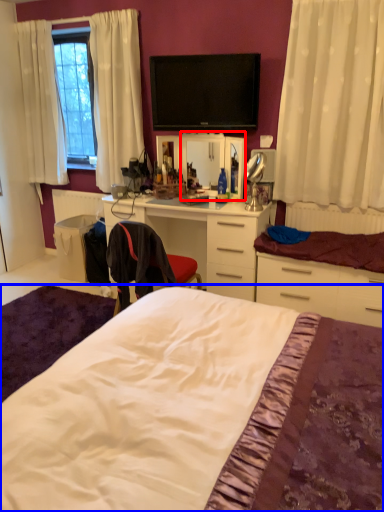
Question: Which object is closer to the camera taking this photo, mirror (highlighted by a red box) or bed (highlighted by a blue box)?

Choices:
 (A) mirror
 (B) bed

Answer: (B)